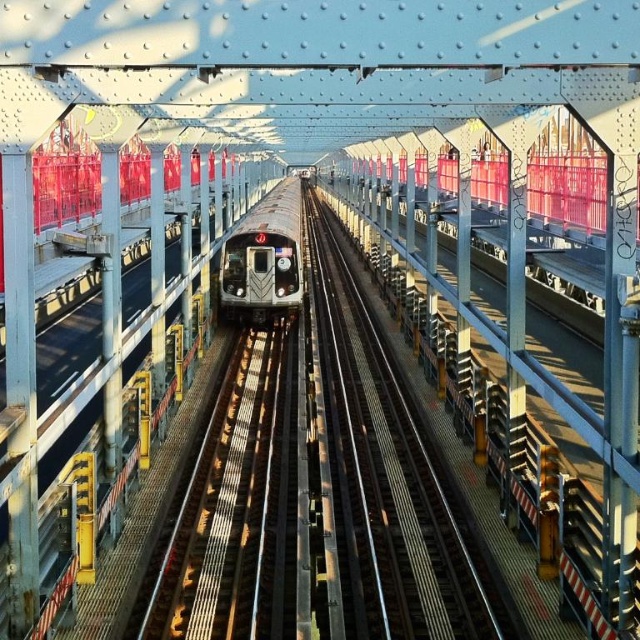
You are a passenger waiting at the subway station and want to board the silver metallic train at center. The train is approaching from the left. Which side of the metal train track at center should you stand on to board the train safely?

The metal train track at center is positioned on the right side of the silver metallic train at center, so you should stand on the left side of the metal train track at center to board the train safely as the train is coming from the left.